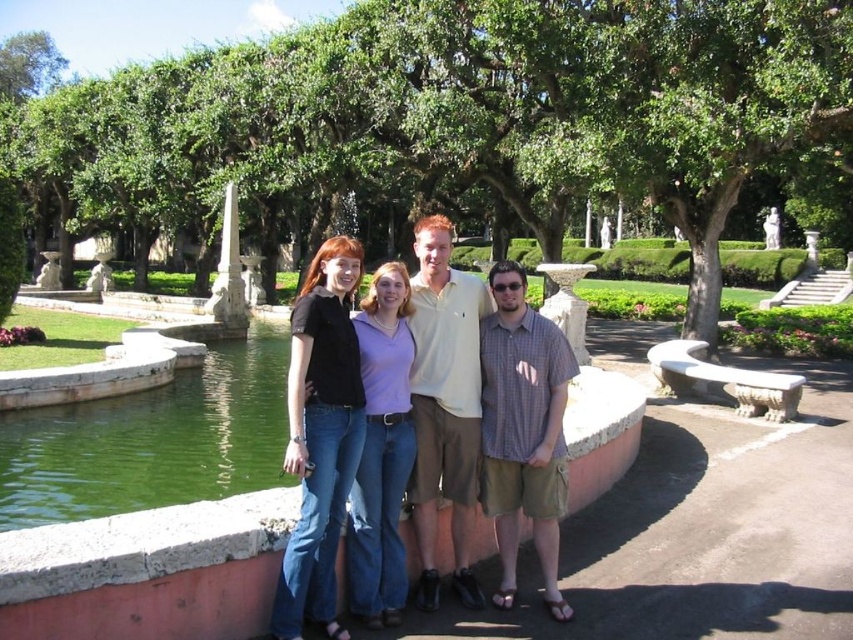
Can you confirm if green liquid water at lower left is taller than denim jeans at center?

No.

This screenshot has width=853, height=640. I want to click on green liquid water at lower left, so click(x=152, y=440).

Is green liquid water at lower left shorter than light beige polo shirt at center?

Indeed, green liquid water at lower left has a lesser height compared to light beige polo shirt at center.

What do you see at coordinates (152, 440) in the screenshot? The width and height of the screenshot is (853, 640). I see `green liquid water at lower left` at bounding box center [152, 440].

Does point (97, 428) lie behind point (434, 497)?

Yes, it is.

At what (x,y) coordinates should I click in order to perform the action: click on green liquid water at lower left. Please return your answer as a coordinate pair (x, y). The image size is (853, 640). Looking at the image, I should click on (152, 440).

Which is below, checkered fabric shirt at center or light beige polo shirt at center?

checkered fabric shirt at center

Between point (482, 320) and point (434, 385), which one is positioned in front?

Point (434, 385)

At what (x,y) coordinates should I click in order to perform the action: click on checkered fabric shirt at center. Please return your answer as a coordinate pair (x, y). Looking at the image, I should click on (523, 429).